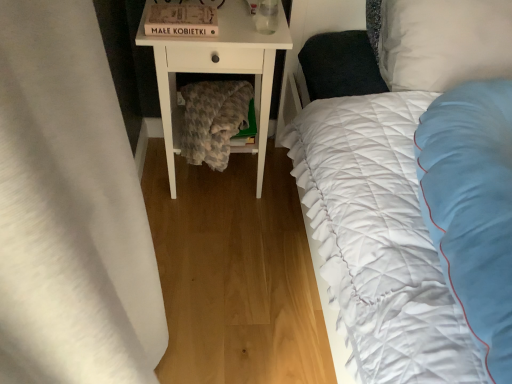
You are a GUI agent. You are given a task and a screenshot of the screen. Output one action in this format:
    pyautogui.click(x=<x>, y=<y>)
    Task: Click on the free spot above fuzzy gray blanket at lower center (from a real-world perspective)
    
    Given the screenshot: What is the action you would take?
    tap(215, 87)